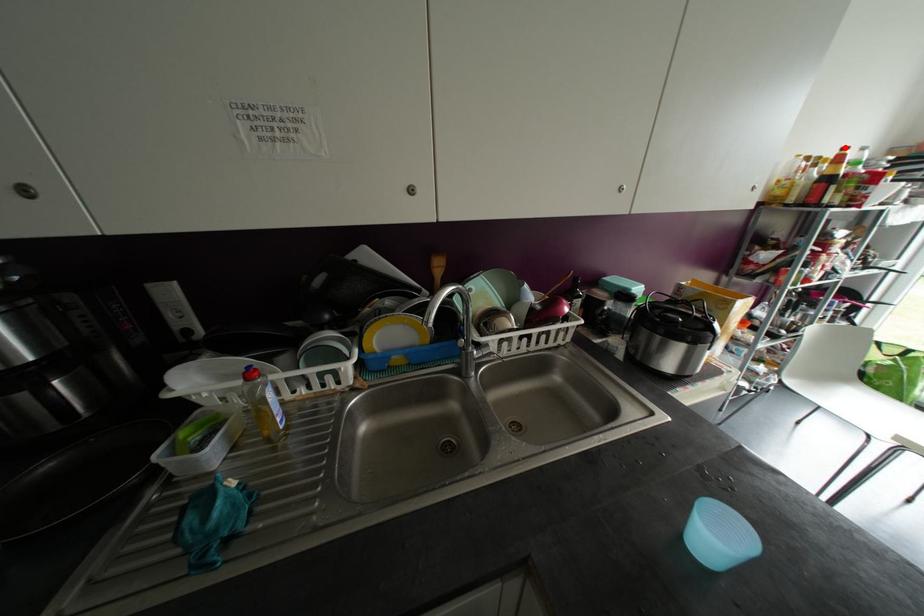
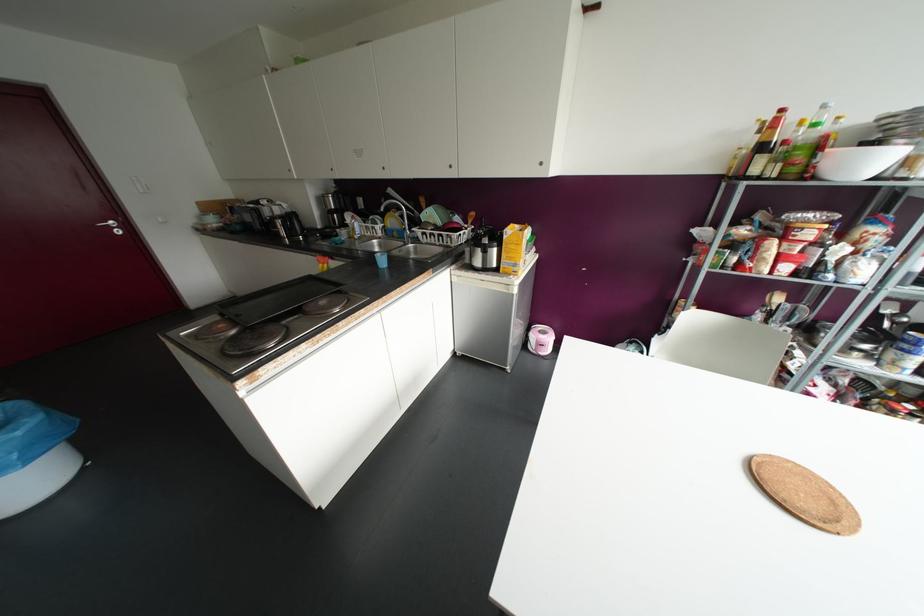
Question: I am providing you with two images of the same scene from different viewpoints. Given a red point in image1, look at the same physical point in image2. Is it:

Choices:
 (A) Closer to the viewpoint
 (B) Farther from the viewpoint

Answer: (A)